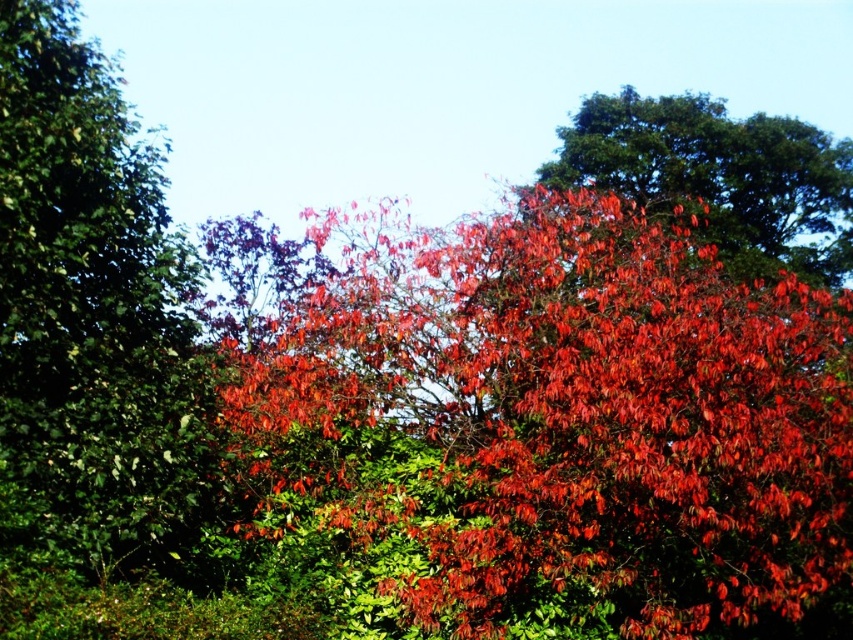
Question: Does green matte leaves at left appear under shiny red leaves at upper right?

Choices:
 (A) yes
 (B) no

Answer: (B)

Question: Does green matte leaves at left have a lesser width compared to shiny red leaves at upper right?

Choices:
 (A) yes
 (B) no

Answer: (A)

Question: Does green matte leaves at left have a smaller size compared to shiny red leaves at upper right?

Choices:
 (A) no
 (B) yes

Answer: (B)

Question: Which point appears farthest from the camera in this image?

Choices:
 (A) (102, 557)
 (B) (769, 198)

Answer: (B)

Question: Which of the following is the closest to the observer?

Choices:
 (A) green matte leaves at left
 (B) shiny red leaves at upper right

Answer: (A)